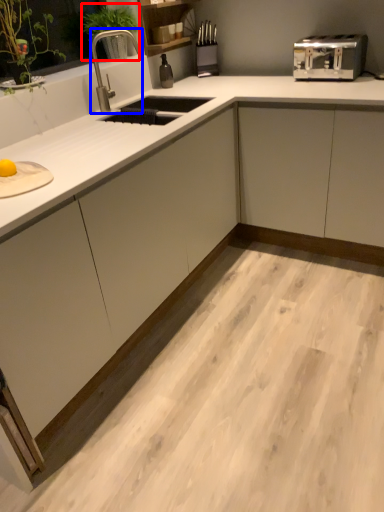
Question: Among these objects, which one is nearest to the camera, plant (highlighted by a red box) or faucet (highlighted by a blue box)?

Choices:
 (A) plant
 (B) faucet

Answer: (B)